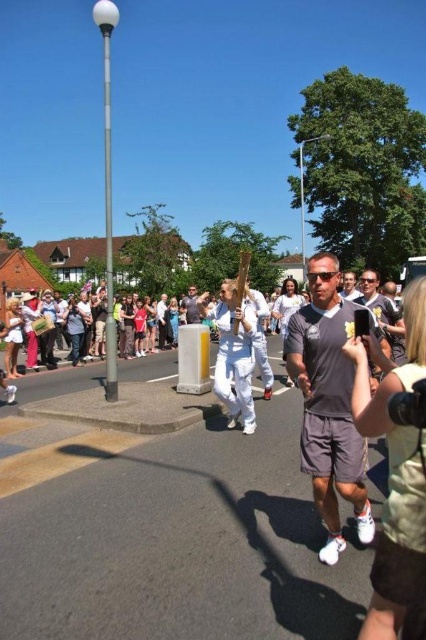
Which is behind, point (354, 474) or point (348, 273)?

Point (348, 273)

Is gray matte shorts at center further to camera compared to matte gray t-shirt at center?

No, it is not.

Find the location of a particular element. The image size is (426, 640). gray matte shorts at center is located at coordinates (328, 404).

Find the location of `gray matte shorts at center`. gray matte shorts at center is located at coordinates (328, 404).

The height and width of the screenshot is (640, 426). I want to click on gray matte shorts at center, so click(x=328, y=404).

Can you confirm if white cotton shirt at center is wider than matte gray t-shirt at center?

Yes, white cotton shirt at center is wider than matte gray t-shirt at center.

How distant is white cotton shirt at center from matte gray t-shirt at center?

white cotton shirt at center and matte gray t-shirt at center are 12.95 meters apart.

Describe the element at coordinates (192, 305) in the screenshot. This screenshot has width=426, height=640. I see `white cotton shirt at center` at that location.

Image resolution: width=426 pixels, height=640 pixels. What are the coordinates of `white cotton shirt at center` in the screenshot? It's located at (192, 305).